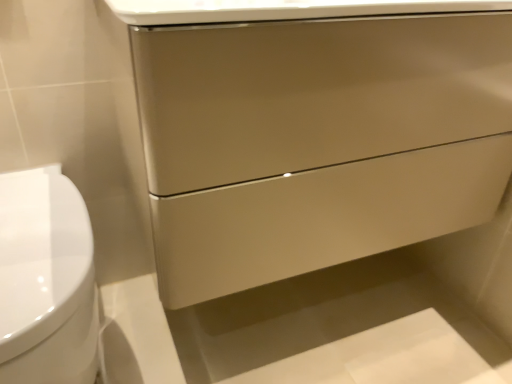
I want to click on white glossy toilet at left, so click(x=46, y=280).

What do you see at coordinates (46, 280) in the screenshot? I see `white glossy toilet at left` at bounding box center [46, 280].

Identify the location of matte beige drawer at center. (315, 93).

Describe the element at coordinates (315, 93) in the screenshot. I see `matte beige drawer at center` at that location.

The image size is (512, 384). I want to click on white glossy toilet at left, so click(x=46, y=280).

Which object is positioned more to the right, white glossy toilet at left or matte beige drawer at center?

matte beige drawer at center is more to the right.

Is white glossy toilet at left positioned behind matte beige drawer at center?

No, the depth of white glossy toilet at left is less than that of matte beige drawer at center.

Which is behind, point (39, 241) or point (423, 122)?

The point (423, 122) is farther.

From the image's perspective, which one is positioned lower, white glossy toilet at left or matte beige drawer at center?

From the image's view, white glossy toilet at left is below.

From a real-world perspective, is white glossy toilet at left positioned over matte beige drawer at center based on gravity?

Incorrect, from a real-world perspective, white glossy toilet at left is lower than matte beige drawer at center.

Does white glossy toilet at left have a greater width compared to matte beige drawer at center?

Indeed, white glossy toilet at left has a greater width compared to matte beige drawer at center.

Is white glossy toilet at left shorter than matte beige drawer at center?

In fact, white glossy toilet at left may be taller than matte beige drawer at center.

Considering the sizes of objects white glossy toilet at left and matte beige drawer at center in the image provided, who is bigger, white glossy toilet at left or matte beige drawer at center?

With larger size is matte beige drawer at center.

Is white glossy toilet at left inside or outside of matte beige drawer at center?

white glossy toilet at left is outside matte beige drawer at center.

Is white glossy toilet at left beside matte beige drawer at center?

white glossy toilet at left is not next to matte beige drawer at center, and they're not touching.

Is white glossy toilet at left looking in the opposite direction of matte beige drawer at center?

white glossy toilet at left is not turned away from matte beige drawer at center.

Where is `drawer located behind the white glossy toilet at left`? drawer located behind the white glossy toilet at left is located at coordinates (315, 93).

Between matte beige drawer at center and white glossy toilet at left, which one appears on the right side from the viewer's perspective?

Positioned to the right is matte beige drawer at center.

Which object is further away from the camera taking this photo, matte beige drawer at center or white glossy toilet at left?

matte beige drawer at center is more distant.

Is point (229, 130) positioned before point (76, 246)?

Yes, point (229, 130) is closer to viewer.

From the image's perspective, is matte beige drawer at center above or below white glossy toilet at left?

Clearly, from the image's perspective, matte beige drawer at center is above white glossy toilet at left.

From a real-world perspective, relative to white glossy toilet at left, is matte beige drawer at center vertically above or below?

Clearly, from a real-world perspective, matte beige drawer at center is above white glossy toilet at left.

Which object is wider, matte beige drawer at center or white glossy toilet at left?

Wider between the two is white glossy toilet at left.

From the picture: In terms of height, does matte beige drawer at center look taller or shorter compared to white glossy toilet at left?

In the image, matte beige drawer at center appears to be shorter than white glossy toilet at left.

In terms of size, does matte beige drawer at center appear bigger or smaller than white glossy toilet at left?

Clearly, matte beige drawer at center is larger in size than white glossy toilet at left.

Is matte beige drawer at center positioned beyond the bounds of white glossy toilet at left?

Absolutely, matte beige drawer at center is external to white glossy toilet at left.

Is matte beige drawer at center touching white glossy toilet at left?

No, matte beige drawer at center is not touching white glossy toilet at left.

Is matte beige drawer at center facing towards white glossy toilet at left?

No, matte beige drawer at center is not oriented towards white glossy toilet at left.

Where is `toilet below the matte beige drawer at center (from the image's perspective)`? Image resolution: width=512 pixels, height=384 pixels. toilet below the matte beige drawer at center (from the image's perspective) is located at coordinates (46, 280).

The height and width of the screenshot is (384, 512). What are the coordinates of `drawer located above the white glossy toilet at left (from a real-world perspective)` in the screenshot? It's located at (315, 93).

At what (x,y) coordinates should I click in order to perform the action: click on toilet below the matte beige drawer at center (from the image's perspective). Please return your answer as a coordinate pair (x, y). Looking at the image, I should click on (46, 280).